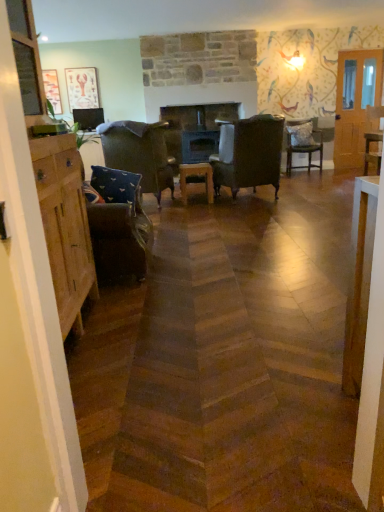
Question: Can you confirm if textured gray pillow at center-right, which ranks as the 1th pillow in top-to-bottom order, is shorter than matte paper picture frame at upper left, the second picture frame when ordered from left to right?

Choices:
 (A) yes
 (B) no

Answer: (A)

Question: Is textured gray pillow at center-right, acting as the 2th pillow starting from the left, at the right side of matte paper picture frame at upper left, the second picture frame when ordered from left to right?

Choices:
 (A) yes
 (B) no

Answer: (A)

Question: From the image's perspective, is textured gray pillow at center-right, the 2th pillow ordered from the bottom, beneath matte paper picture frame at upper left, the 1th picture frame viewed from the right?

Choices:
 (A) yes
 (B) no

Answer: (A)

Question: Is textured gray pillow at center-right, acting as the 2th pillow starting from the left, not inside matte paper picture frame at upper left, the 1th picture frame viewed from the right?

Choices:
 (A) yes
 (B) no

Answer: (A)

Question: Are textured gray pillow at center-right, the 2th pillow ordered from the bottom, and matte paper picture frame at upper left, the 1th picture frame viewed from the right, far apart?

Choices:
 (A) yes
 (B) no

Answer: (A)

Question: Is textured gray pillow at center-right, which appears as the first pillow when viewed from the back, next to matte paper picture frame at upper left, the 1th picture frame viewed from the right, and touching it?

Choices:
 (A) yes
 (B) no

Answer: (B)

Question: Is blue fabric pillow at left, acting as the second pillow starting from the top, to the right of brown leather chair at center, which is the 3th chair from right to left, from the viewer's perspective?

Choices:
 (A) yes
 (B) no

Answer: (B)

Question: From a real-world perspective, is blue fabric pillow at left, which is the 1th pillow from bottom to top, physically above brown leather chair at center, positioned as the second chair in left-to-right order?

Choices:
 (A) no
 (B) yes

Answer: (B)

Question: Is blue fabric pillow at left, marked as the second pillow in a right-to-left arrangement, surrounding brown leather chair at center, positioned as the second chair in left-to-right order?

Choices:
 (A) yes
 (B) no

Answer: (B)

Question: Is blue fabric pillow at left, the 1th pillow viewed from the front, far from brown leather chair at center, which is the 3th chair from right to left?

Choices:
 (A) no
 (B) yes

Answer: (B)

Question: From the image's perspective, is blue fabric pillow at left, which is the 1th pillow from bottom to top, above brown leather chair at center, which is the 3th chair from right to left?

Choices:
 (A) no
 (B) yes

Answer: (A)

Question: From a real-world perspective, is blue fabric pillow at left, acting as the second pillow starting from the top, under brown leather chair at center, which is the 3th chair from right to left?

Choices:
 (A) no
 (B) yes

Answer: (A)

Question: Does matte paper picture frame at upper left, the 1th picture frame viewed from the right, touch patterned fabric chair at center-right, arranged as the third chair when viewed from the left?

Choices:
 (A) yes
 (B) no

Answer: (B)